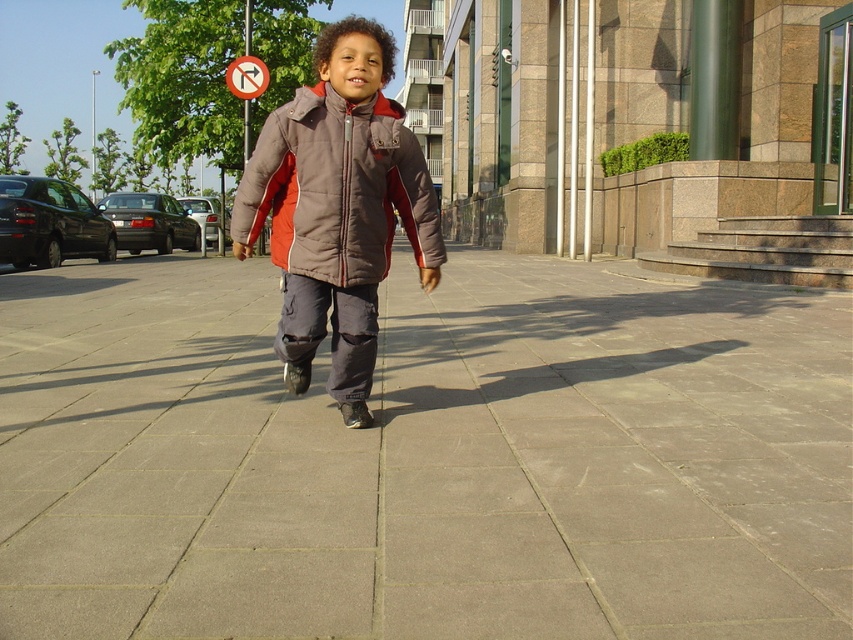
You are a delivery robot that needs to navigate through the sidewalk. The gray concrete pavement at center and the brown puffy jacket at center are in your path. Which one has a wider width that allows easier passage?

The gray concrete pavement at center has a larger width than the brown puffy jacket at center, so it allows easier passage.

You are a delivery drone flying above the urban area. You need to land on the gray concrete pavement at center. Is the brown puffy jacket at center in the way of your landing spot?

The gray concrete pavement at center is below the brown puffy jacket at center, so the brown puffy jacket at center is blocking the landing spot. Choose another location to land.